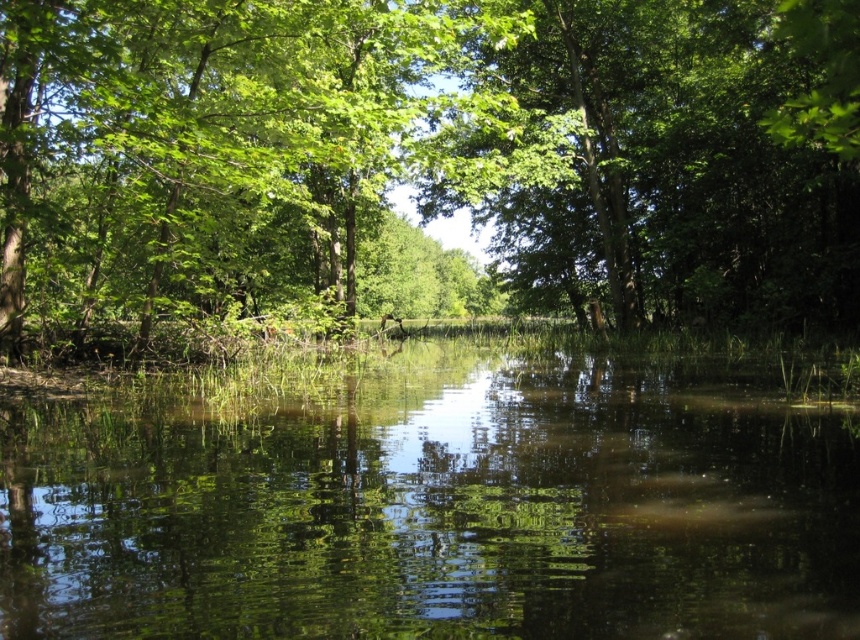
Question: From the image, what is the correct spatial relationship of green leafy tree at center in relation to green reflective water at center?

Choices:
 (A) below
 (B) above

Answer: (B)

Question: Is green leafy tree at center above green reflective water at center?

Choices:
 (A) no
 (B) yes

Answer: (B)

Question: Which object appears farthest from the camera in this image?

Choices:
 (A) green leafy tree at center
 (B) green reflective water at center

Answer: (A)

Question: Is green leafy tree at center below green reflective water at center?

Choices:
 (A) yes
 (B) no

Answer: (B)

Question: Which point is farther to the camera?

Choices:
 (A) (544, 273)
 (B) (698, 444)

Answer: (A)

Question: Which point is closer to the camera taking this photo?

Choices:
 (A) (508, 634)
 (B) (379, 163)

Answer: (A)